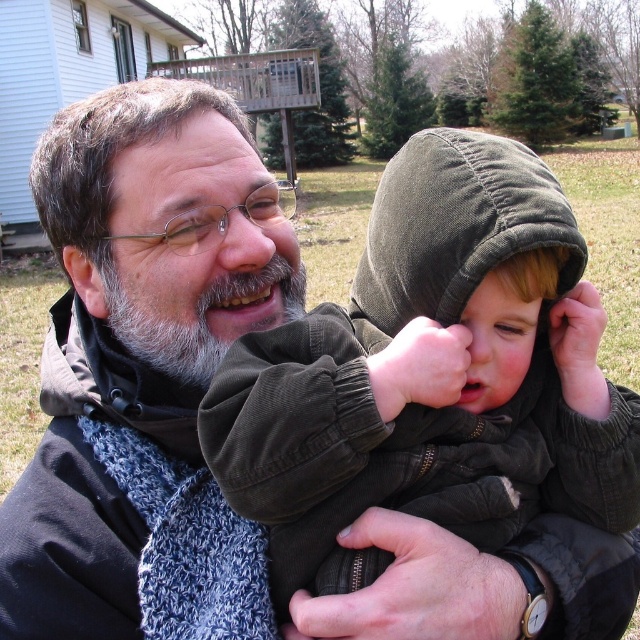
You are a fashion designer observing the scene. You notice the knitted scarf at center and the dark green corduroy hoodie at center. Which item of clothing is smaller in size?

The knitted scarf at center is smaller in size compared to the dark green corduroy hoodie at center.

You are a photographer trying to capture the scene where the adult and child are interacting. You notice the knitted scarf at center and the dark green corduroy hoodie at center. Which one is positioned higher in the image?

The knitted scarf at center is above the dark green corduroy hoodie at center, so the knitted scarf at center is positioned higher in the image.